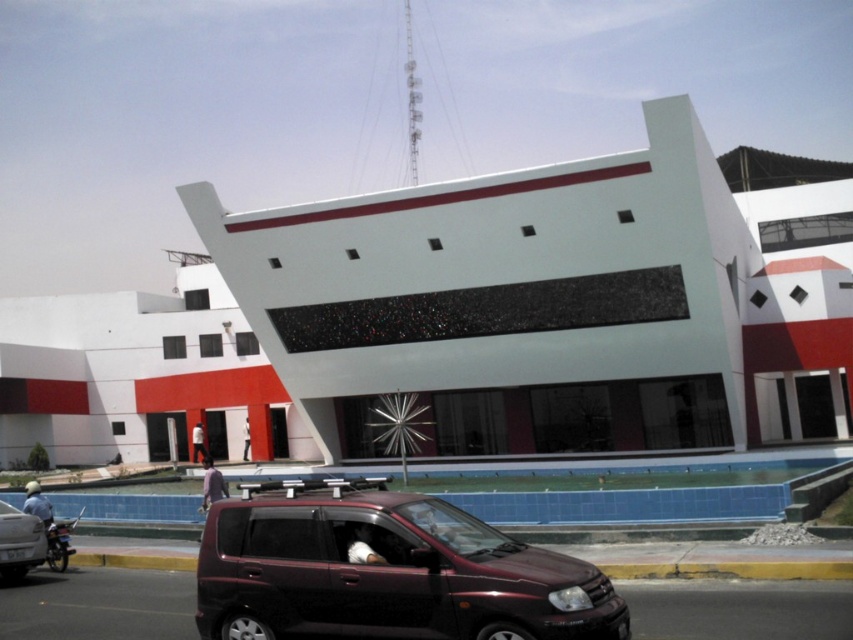
Question: Which object appears closest to the camera in this image?

Choices:
 (A) shiny maroon minivan at center
 (B) matte black car at lower left

Answer: (A)

Question: Which object appears farthest from the camera in this image?

Choices:
 (A) shiny maroon minivan at center
 (B) matte black car at lower left

Answer: (B)

Question: Can you confirm if shiny maroon minivan at center is positioned below matte black car at lower left?

Choices:
 (A) no
 (B) yes

Answer: (B)

Question: Is shiny maroon minivan at center further to the viewer compared to matte black car at lower left?

Choices:
 (A) yes
 (B) no

Answer: (B)

Question: Can you confirm if shiny maroon minivan at center is smaller than matte black car at lower left?

Choices:
 (A) no
 (B) yes

Answer: (A)